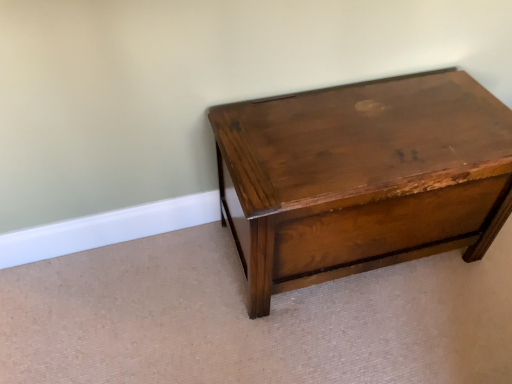
Describe the element at coordinates (362, 177) in the screenshot. This screenshot has width=512, height=384. I see `shiny brown wood chest at center` at that location.

Identify the location of shiny brown wood chest at center. The height and width of the screenshot is (384, 512). (362, 177).

Identify the location of shiny brown wood chest at center. Image resolution: width=512 pixels, height=384 pixels. (362, 177).